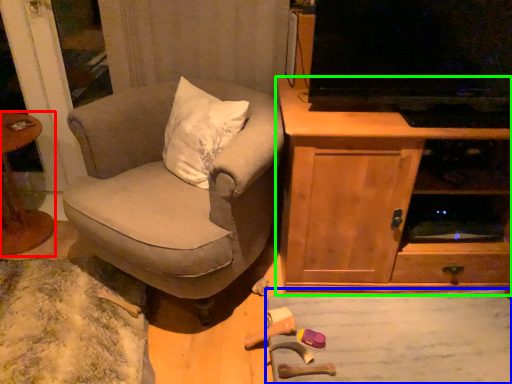
Question: Based on their relative distances, which object is farther from table (highlighted by a red box)? Choose from plain (highlighted by a blue box) and cabinetry (highlighted by a green box).

Choices:
 (A) plain
 (B) cabinetry

Answer: (A)